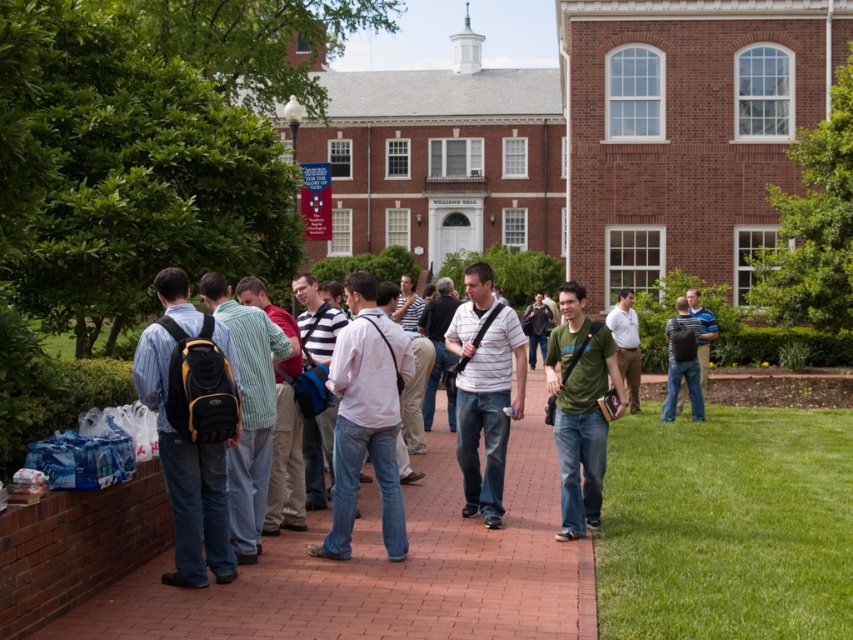
Is green grass at lower right positioned in front of green matte shirt at center?

Yes.

Is green grass at lower right positioned behind green matte shirt at center?

No, it is in front of green matte shirt at center.

Describe the element at coordinates (727, 525) in the screenshot. I see `green grass at lower right` at that location.

In order to click on green grass at lower right in this screenshot , I will do `click(727, 525)`.

Is point (469, 564) farther from viewer compared to point (592, 429)?

No, it is not.

Which is more to the right, brick pavement at center or green matte shirt at center?

From the viewer's perspective, green matte shirt at center appears more on the right side.

Is point (440, 556) positioned behind point (570, 337)?

That is False.

Locate an element on the screen. This screenshot has height=640, width=853. brick pavement at center is located at coordinates (387, 568).

Which is more to the left, brick pavement at center or green grass at lower right?

brick pavement at center

Which is below, brick pavement at center or green grass at lower right?

green grass at lower right is below.

Is point (422, 468) positioned in front of point (630, 596)?

No, it is behind (630, 596).

The height and width of the screenshot is (640, 853). I want to click on brick pavement at center, so point(387,568).